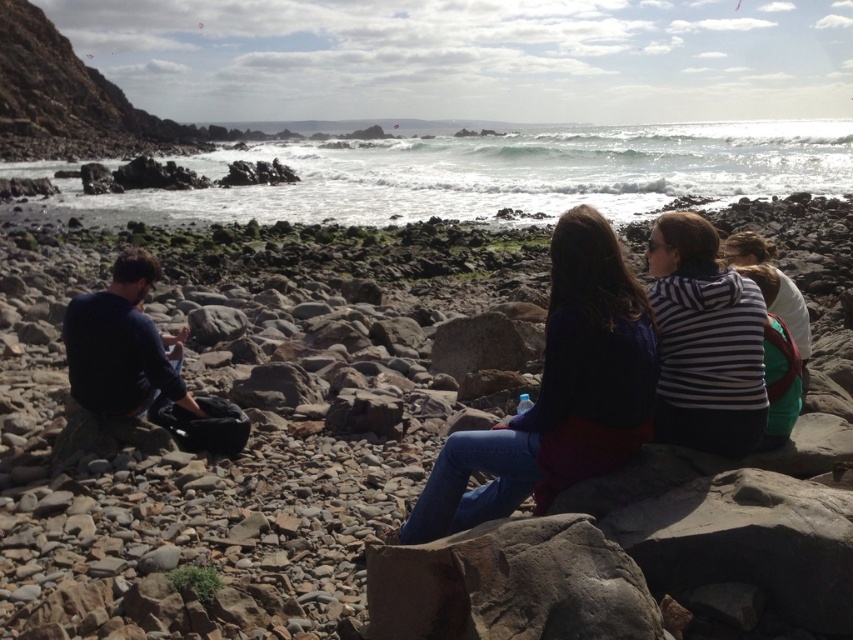
You are a photographer standing at the shoreline. You want to capture a photo where the brown rough rock at center is clearly visible above the dark blue sweater at center. Based on the scene description, can you confirm if this is possible?

Yes, the brown rough rock at center is taller than the dark blue sweater at center, so it will naturally appear above it in the photo.

Looking at this image, you are a photographer trying to capture a shot of the brown rough rock at center and the dark blue sweater at center. Based on their positions, which object would appear closer to the camera in the photo?

The brown rough rock at center appears closer to the camera because it is positioned above the dark blue sweater at center, indicating it is in a higher plane in the scene.

You are a hiker who has just arrived at the rocky shoreline and notices the dark blue sweater at left and the striped fabric hoodie at right. Which item of clothing should you pick up first if you want to collect the smaller one first?

The striped fabric hoodie at right is smaller than the dark blue sweater at left, so you should pick up the striped fabric hoodie at right first.